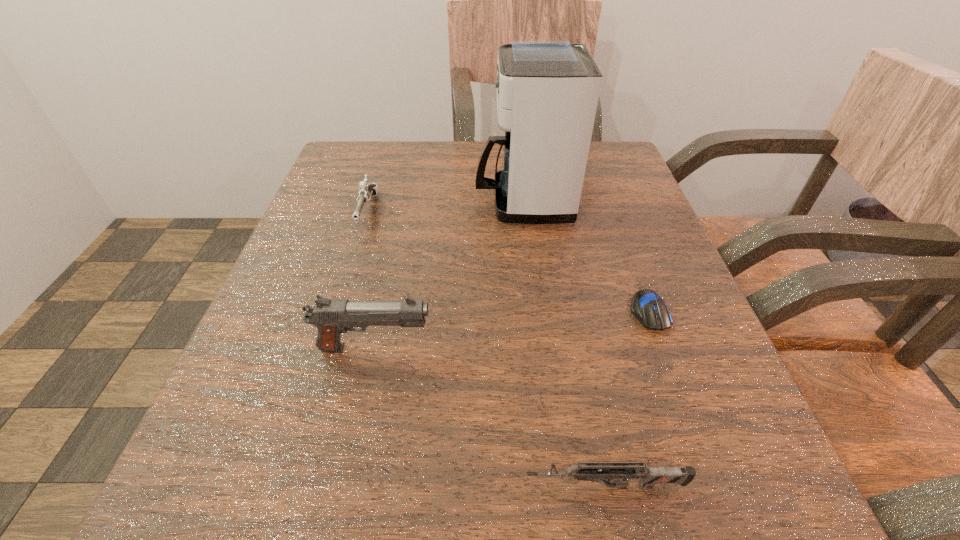
Where is `the tallest object`? The width and height of the screenshot is (960, 540). the tallest object is located at coordinates (547, 90).

I want to click on the second nearest gun, so click(x=332, y=317).

What are the coordinates of `the fourth farthest object` in the screenshot? It's located at (332, 317).

Where is `the second tallest gun`? The image size is (960, 540). the second tallest gun is located at coordinates (366, 190).

Where is `the farthest gun`? Image resolution: width=960 pixels, height=540 pixels. the farthest gun is located at coordinates (366, 190).

Identify the location of the nearest gun. This screenshot has width=960, height=540. (590, 471).

Where is `the shortest gun`? The width and height of the screenshot is (960, 540). the shortest gun is located at coordinates (590, 471).

The height and width of the screenshot is (540, 960). Find the location of `computer mouse`. computer mouse is located at coordinates (647, 306).

Image resolution: width=960 pixels, height=540 pixels. Find the location of `the shortest object`. the shortest object is located at coordinates (647, 306).

In order to click on vacant space located 0.290m on the front panel of the tallest object in this screenshot , I will do `click(331, 201)`.